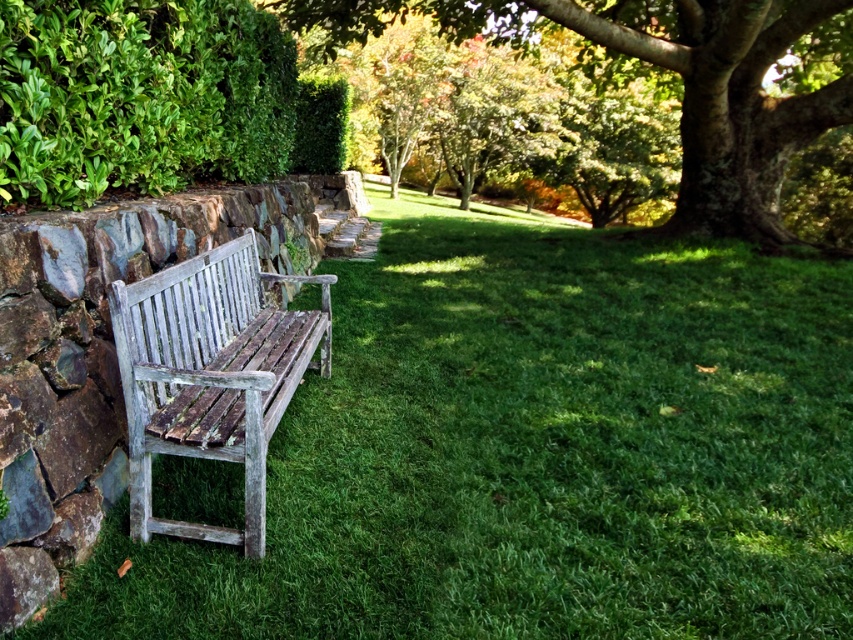
You are a gardener planning to trim both the green leafy bush at upper left and the green leafy tree at center. Based on their sizes, which one requires more time and effort?

The green leafy bush at upper left requires more time and effort because it is bigger than the green leafy tree at center.

You are planning to place a small garden statue between the green leafy bush at upper left and the weathered wood bench at left. Based on their sizes, which object should the statue be closer to?

The statue should be placed closer to the weathered wood bench at left because the green leafy bush at upper left is larger in size, so the bench is smaller and there might be more space near it for the statue.